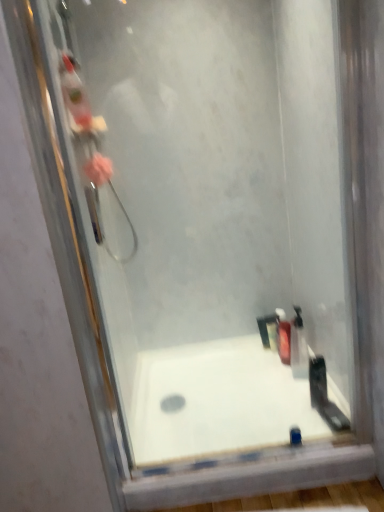
Identify the location of unoccupied space behind black plastic razor at right, the third toiletry when ordered from back to front. [289, 380].